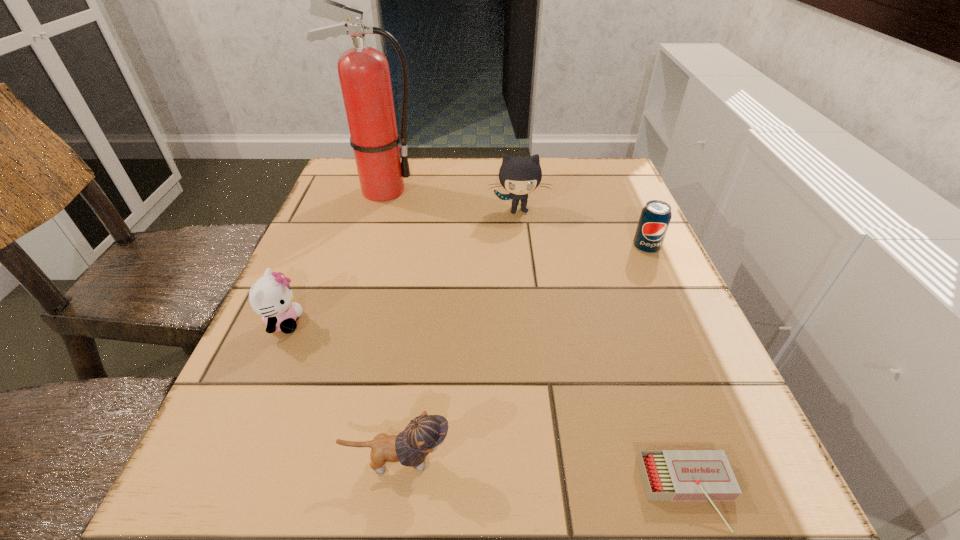
Where is `kitten situated at the left edge`? kitten situated at the left edge is located at coordinates (270, 296).

Find the location of a particular element. soda can located in the right edge section of the desktop is located at coordinates (655, 217).

The width and height of the screenshot is (960, 540). Find the location of `matchbox located in the right edge section of the desktop`. matchbox located in the right edge section of the desktop is located at coordinates (667, 475).

Image resolution: width=960 pixels, height=540 pixels. Find the location of `object located at the far left corner`. object located at the far left corner is located at coordinates (364, 75).

At what (x,y) coordinates should I click in order to perform the action: click on object at the near right corner. Please return your answer as a coordinate pair (x, y). Image resolution: width=960 pixels, height=540 pixels. Looking at the image, I should click on (667, 475).

In the image, there is a desktop. Find the location of `vacant space at the far edge`. vacant space at the far edge is located at coordinates (476, 161).

Where is `free space at the near edge of the desktop`? The height and width of the screenshot is (540, 960). free space at the near edge of the desktop is located at coordinates (348, 517).

At what (x,y) coordinates should I click in order to perform the action: click on vacant area at the left edge of the desktop. Please return your answer as a coordinate pair (x, y). The height and width of the screenshot is (540, 960). Looking at the image, I should click on (334, 211).

Where is `vacant area at the right edge of the desktop`? vacant area at the right edge of the desktop is located at coordinates (628, 258).

The image size is (960, 540). Find the location of `free space at the near left corner of the desktop`. free space at the near left corner of the desktop is located at coordinates (251, 516).